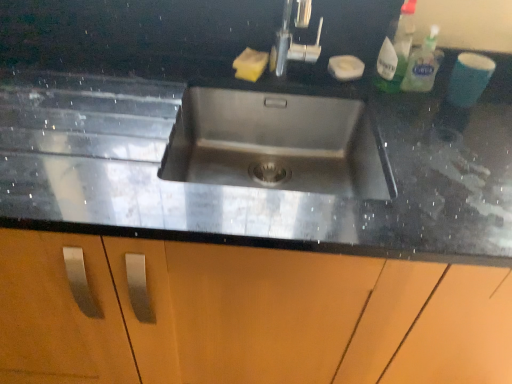
Identify the location of free location to the left of clear plastic bottle at upper right, the 2th cleaning product positioned from the left. (352, 84).